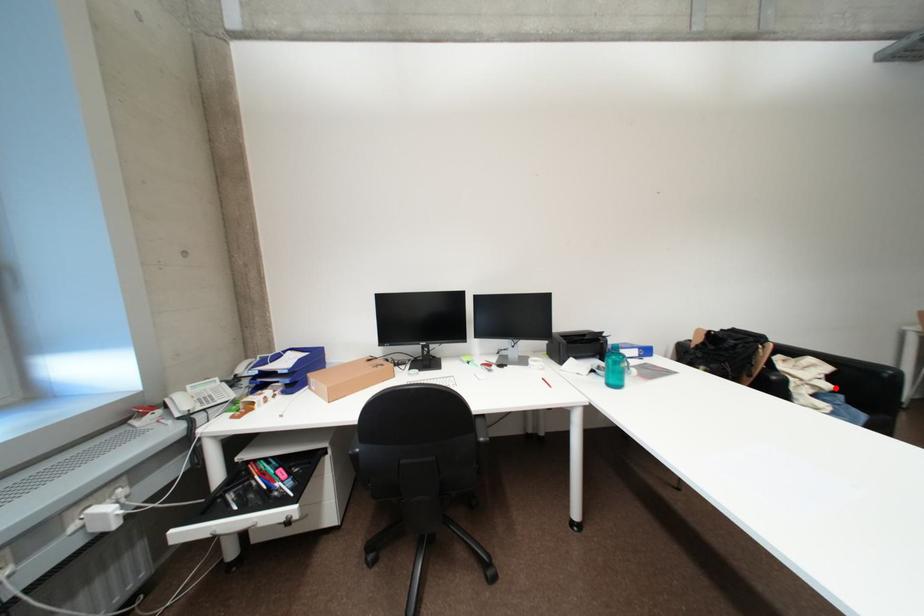
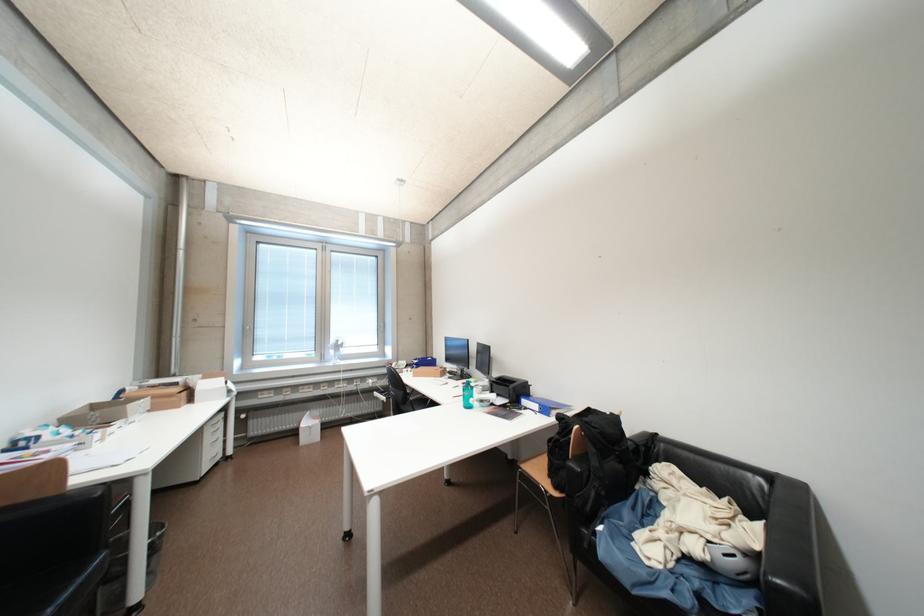
Question: I am providing you with two images of the same scene from different viewpoints. In image1, a red point is highlighted. Considering the same 3D point in image2, which of the following is correct?

Choices:
 (A) It is closer
 (B) It is farther

Answer: (B)